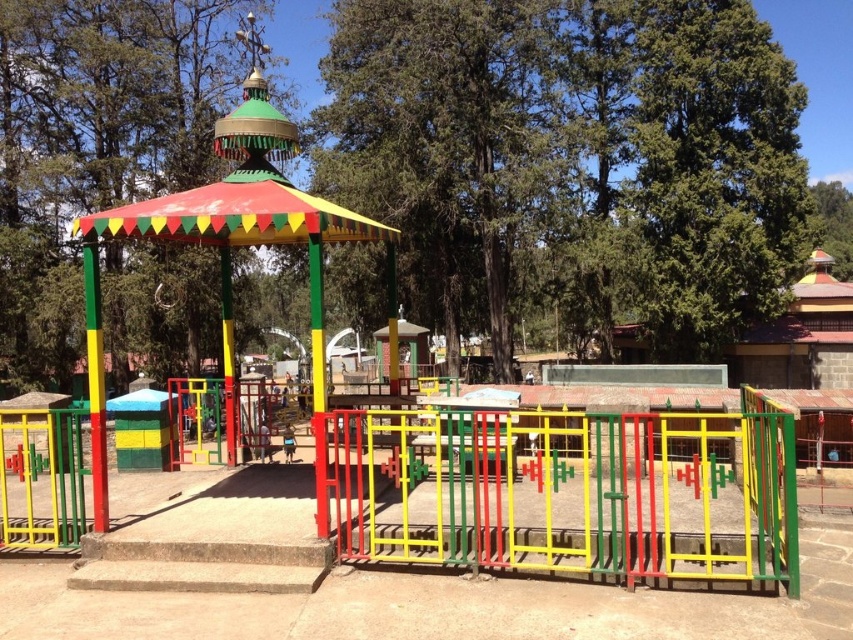
Who is lower down, metallic painted gate at center or multicolored painted gazebo at center?

metallic painted gate at center is lower down.

Is metallic painted gate at center behind multicolored painted gazebo at center?

Yes, it is behind multicolored painted gazebo at center.

The image size is (853, 640). Identify the location of metallic painted gate at center. (569, 492).

I want to click on metallic painted gate at center, so click(569, 492).

Can you confirm if metallic painted gate at center is bigger than green painted wood gazebo at center?

Actually, metallic painted gate at center might be smaller than green painted wood gazebo at center.

Who is lower down, metallic painted gate at center or green painted wood gazebo at center?

metallic painted gate at center

I want to click on metallic painted gate at center, so click(569, 492).

Locate an element on the screen. metallic painted gate at center is located at coordinates (x=569, y=492).

Can you confirm if green painted wood gazebo at center is wider than multicolored painted gazebo at center?

Yes.

Between green painted wood gazebo at center and multicolored painted gazebo at center, which one is positioned higher?

green painted wood gazebo at center

Find the location of a particular element. green painted wood gazebo at center is located at coordinates (96, 144).